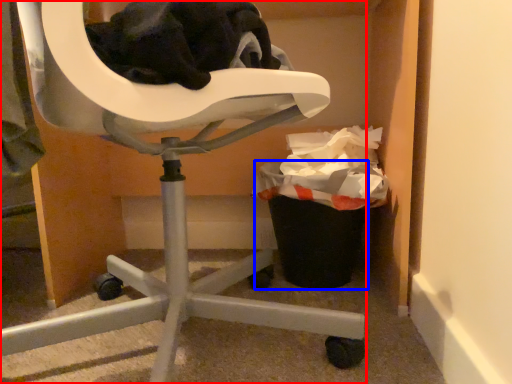
Question: Among these objects, which one is farthest to the camera, chair (highlighted by a red box) or recycling bin (highlighted by a blue box)?

Choices:
 (A) chair
 (B) recycling bin

Answer: (B)